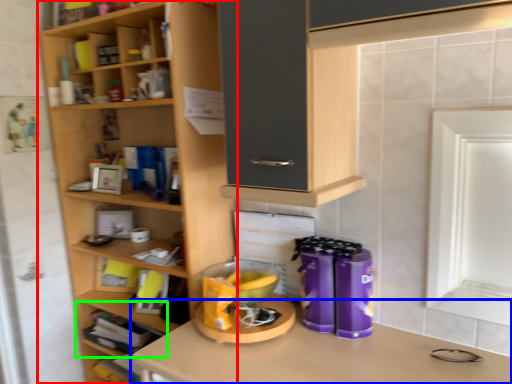
Question: Based on their relative distances, which object is nearer to shelf (highlighted by a red box)? Choose from desk (highlighted by a blue box) and shelf (highlighted by a green box).

Choices:
 (A) desk
 (B) shelf

Answer: (B)